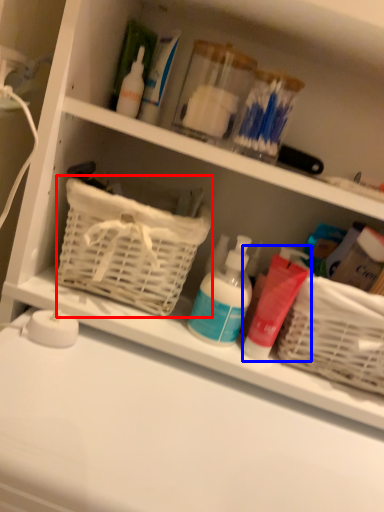
Question: Which point is closer to the camera, basket (highlighted by a red box) or cleaning product (highlighted by a blue box)?

Choices:
 (A) basket
 (B) cleaning product

Answer: (A)